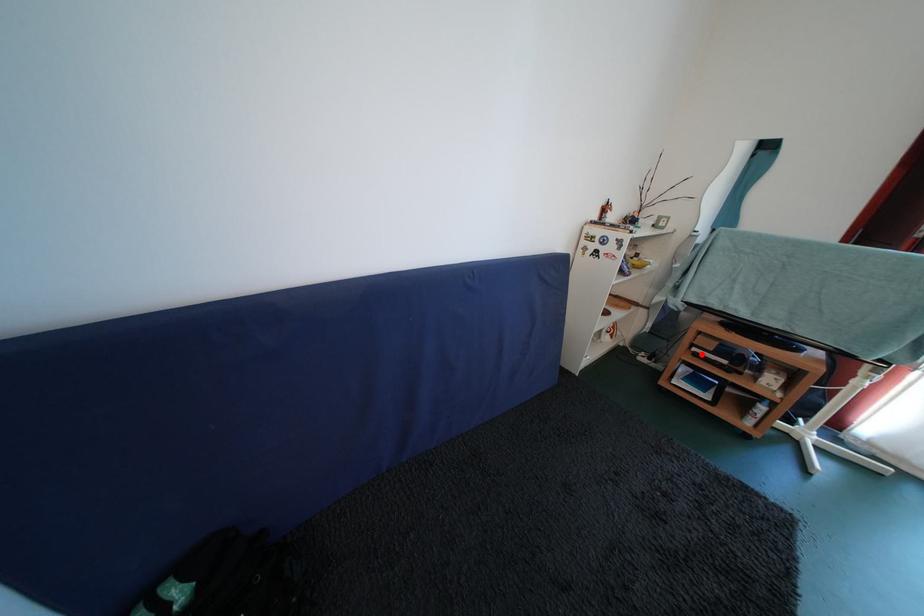
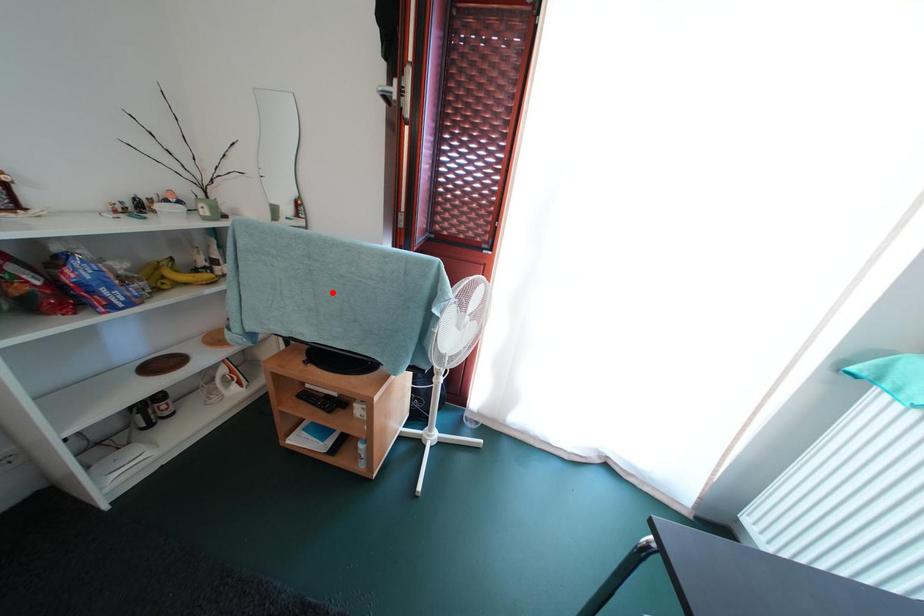
I am providing you with two images of the same scene from different viewpoints. A red point is marked on the first image and another point is marked on the second image. Is the marked point in image1 the same physical position as the marked point in image2?

No